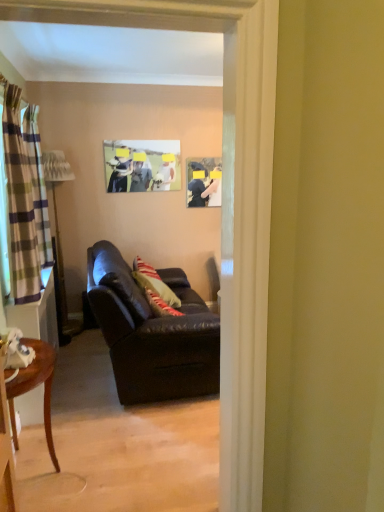
Question: Is leather couch at center thinner than matte plastic picture frame at upper center, the second picture frame positioned from the right?

Choices:
 (A) yes
 (B) no

Answer: (B)

Question: Is matte plastic picture frame at upper center, the second picture frame positioned from the right, a part of leather couch at center?

Choices:
 (A) yes
 (B) no

Answer: (B)

Question: From a real-world perspective, is leather couch at center physically above matte plastic picture frame at upper center, which is the first picture frame in left-to-right order?

Choices:
 (A) yes
 (B) no

Answer: (B)

Question: Does leather couch at center touch matte plastic picture frame at upper center, which is the first picture frame in left-to-right order?

Choices:
 (A) yes
 (B) no

Answer: (B)

Question: Are leather couch at center and matte plastic picture frame at upper center, the second picture frame positioned from the right, located far from each other?

Choices:
 (A) yes
 (B) no

Answer: (A)

Question: From the image's perspective, is plaid fabric curtain at left, which is counted as the 1th curtain, starting from the back, located above or below striped fabric curtain at left, the 1th curtain positioned from the right?

Choices:
 (A) below
 (B) above

Answer: (B)

Question: Based on their sizes in the image, would you say plaid fabric curtain at left, positioned as the 1th curtain in left-to-right order, is bigger or smaller than striped fabric curtain at left, marked as the 2th curtain in a left-to-right arrangement?

Choices:
 (A) small
 (B) big

Answer: (B)

Question: Is point (36, 199) closer or farther from the camera than point (16, 245)?

Choices:
 (A) farther
 (B) closer

Answer: (A)

Question: From their relative heights in the image, would you say plaid fabric curtain at left, positioned as the 2th curtain in front-to-back order, is taller or shorter than striped fabric curtain at left, positioned as the second curtain in back-to-front order?

Choices:
 (A) short
 (B) tall

Answer: (A)

Question: From the image's perspective, relative to plaid fabric curtain at left, which is counted as the second curtain, starting from the right, is matte plastic picture frame at upper center, which is the first picture frame in left-to-right order, above or below?

Choices:
 (A) above
 (B) below

Answer: (A)

Question: Is matte plastic picture frame at upper center, the second picture frame positioned from the right, taller or shorter than plaid fabric curtain at left, positioned as the 1th curtain in left-to-right order?

Choices:
 (A) short
 (B) tall

Answer: (A)

Question: In terms of size, does matte plastic picture frame at upper center, which is the first picture frame in left-to-right order, appear bigger or smaller than plaid fabric curtain at left, which is counted as the 1th curtain, starting from the back?

Choices:
 (A) small
 (B) big

Answer: (A)

Question: Is matte plastic picture frame at upper center, the second picture frame positioned from the right, wider or thinner than plaid fabric curtain at left, positioned as the 1th curtain in left-to-right order?

Choices:
 (A) wide
 (B) thin

Answer: (B)

Question: In terms of size, does striped fabric curtain at left, the 1th curtain in the front-to-back sequence, appear bigger or smaller than leather couch at center?

Choices:
 (A) small
 (B) big

Answer: (A)

Question: In terms of height, does striped fabric curtain at left, marked as the 2th curtain in a left-to-right arrangement, look taller or shorter compared to leather couch at center?

Choices:
 (A) tall
 (B) short

Answer: (A)